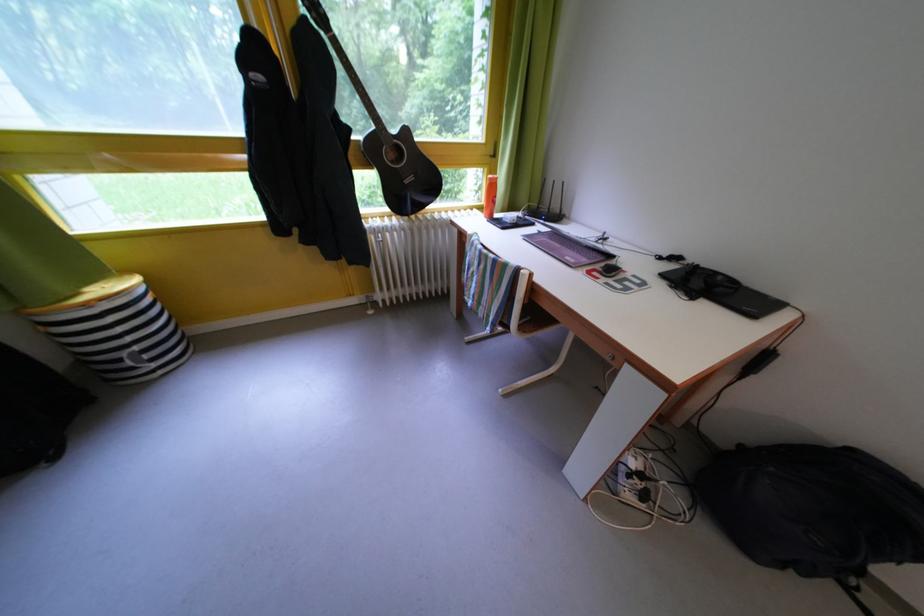
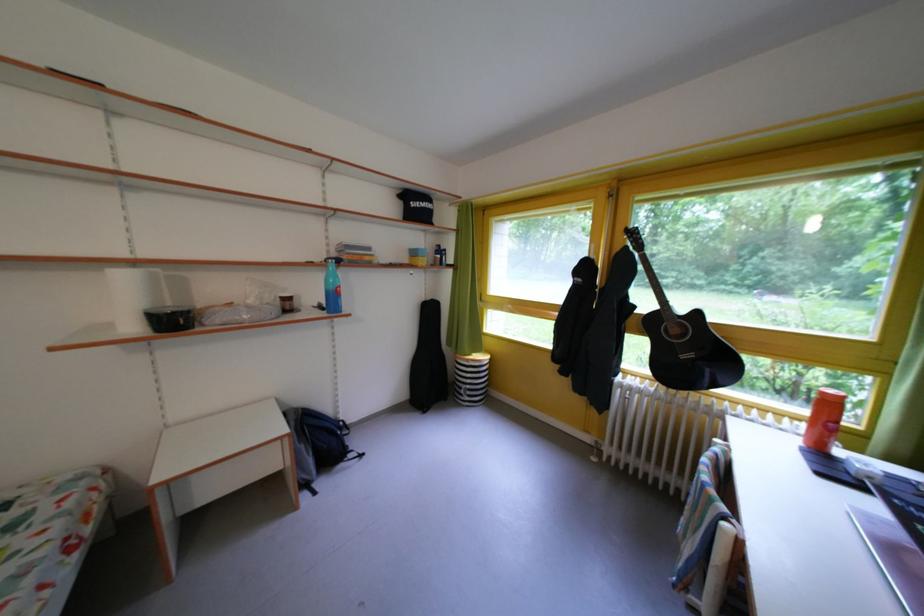
Question: The camera is either moving clockwise (left) or counter-clockwise (right) around the object. The first image is from the beginning of the video and the second image is from the end. Is the camera moving left or right when shooting the video?

Choices:
 (A) Left
 (B) Right

Answer: (B)